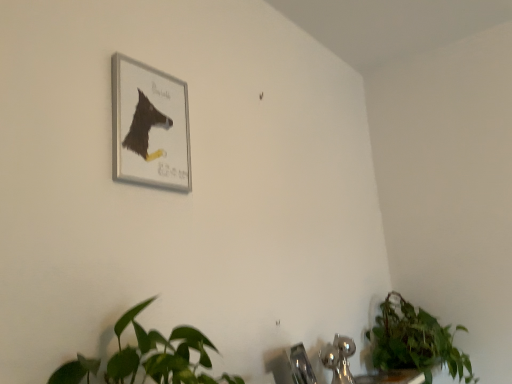
Question: Is green leafy plant at lower right not near satin nickel faucet at lower center?

Choices:
 (A) no
 (B) yes

Answer: (A)

Question: Is green leafy plant at lower right shorter than satin nickel faucet at lower center?

Choices:
 (A) yes
 (B) no

Answer: (B)

Question: From the image's perspective, is green leafy plant at lower right on satin nickel faucet at lower center?

Choices:
 (A) no
 (B) yes

Answer: (A)

Question: Is green leafy plant at lower right to the right of satin nickel faucet at lower center from the viewer's perspective?

Choices:
 (A) yes
 (B) no

Answer: (A)

Question: Would you say satin nickel faucet at lower center is part of green leafy plant at lower right's contents?

Choices:
 (A) yes
 (B) no

Answer: (B)

Question: Is green leafy plant at lower right smaller than satin nickel faucet at lower center?

Choices:
 (A) yes
 (B) no

Answer: (B)

Question: Can you confirm if silver metallic picture frame at upper left is positioned to the right of green leafy plant at lower right?

Choices:
 (A) yes
 (B) no

Answer: (B)

Question: Can you confirm if silver metallic picture frame at upper left is thinner than green leafy plant at lower right?

Choices:
 (A) no
 (B) yes

Answer: (B)

Question: From the image's perspective, is silver metallic picture frame at upper left beneath green leafy plant at lower right?

Choices:
 (A) yes
 (B) no

Answer: (B)

Question: Is silver metallic picture frame at upper left next to green leafy plant at lower right and touching it?

Choices:
 (A) no
 (B) yes

Answer: (A)

Question: Is silver metallic picture frame at upper left positioned beyond the bounds of green leafy plant at lower right?

Choices:
 (A) no
 (B) yes

Answer: (B)

Question: From the image's perspective, is silver metallic picture frame at upper left on green leafy plant at lower right?

Choices:
 (A) no
 (B) yes

Answer: (B)

Question: Can you see green leafy plant at lower right touching chrome metallic sink at lower center?

Choices:
 (A) no
 (B) yes

Answer: (A)